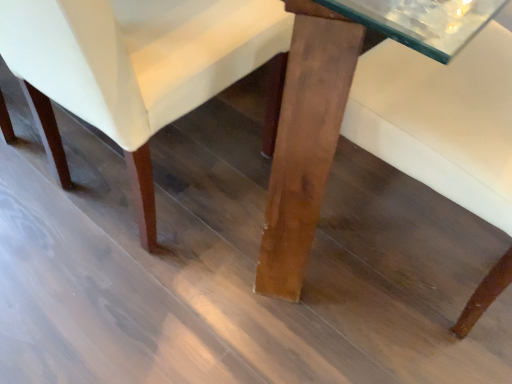
Question: Based on their positions, is wooden table at center located to the left or right of matte wood chair at center?

Choices:
 (A) left
 (B) right

Answer: (B)

Question: Considering their positions, is wooden table at center located in front of or behind matte wood chair at center?

Choices:
 (A) behind
 (B) front

Answer: (B)

Question: Is point (340, 122) closer or farther from the camera than point (179, 14)?

Choices:
 (A) farther
 (B) closer

Answer: (B)

Question: Considering the positions of point (184, 94) and point (306, 177), is point (184, 94) closer or farther from the camera than point (306, 177)?

Choices:
 (A) closer
 (B) farther

Answer: (B)

Question: In the image, is matte wood chair at center positioned in front of or behind wooden table at center?

Choices:
 (A) behind
 (B) front

Answer: (A)

Question: In terms of width, does matte wood chair at center look wider or thinner when compared to wooden table at center?

Choices:
 (A) thin
 (B) wide

Answer: (A)

Question: Which is correct: matte wood chair at center is inside wooden table at center, or outside of it?

Choices:
 (A) inside
 (B) outside

Answer: (B)